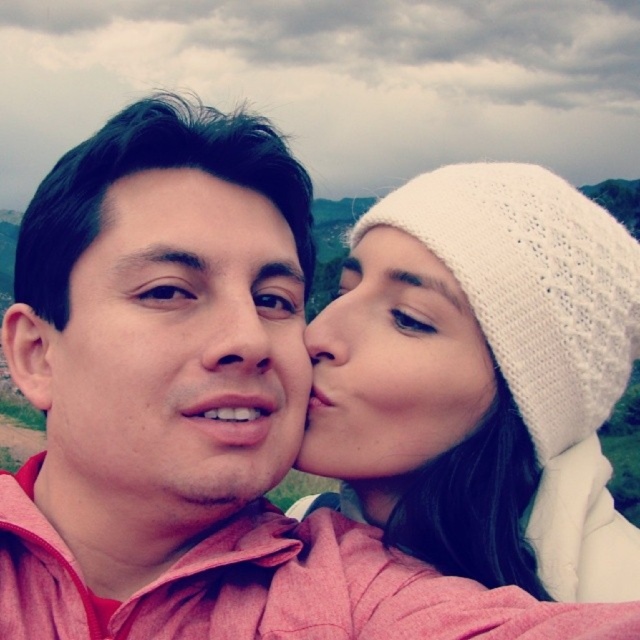
Between white knitted hat at upper right and matte skin nose at center, which one appears on the right side from the viewer's perspective?

From the viewer's perspective, white knitted hat at upper right appears more on the right side.

Can you confirm if white knitted hat at upper right is taller than matte skin nose at center?

Correct, white knitted hat at upper right is much taller as matte skin nose at center.

Is point (452, 349) closer to camera compared to point (218, 356)?

No, it is behind (218, 356).

Where is `white knitted hat at upper right`? The height and width of the screenshot is (640, 640). white knitted hat at upper right is located at coordinates (392, 364).

Can you confirm if matte skin nose at center is positioned to the left of smooth skin nose at center?

Indeed, matte skin nose at center is positioned on the left side of smooth skin nose at center.

Based on the photo, does matte skin nose at center appear over smooth skin nose at center?

No, matte skin nose at center is not above smooth skin nose at center.

Who is more distant from viewer, (x=230, y=346) or (x=349, y=330)?

Positioned behind is point (x=349, y=330).

Identify the location of matte skin nose at center. (243, 333).

Between point (332, 440) and point (420, 436), which one is positioned behind?

The point (332, 440) is behind.

You are a GUI agent. You are given a task and a screenshot of the screen. Output one action in this format:
    pyautogui.click(x=<x>, y=<y>)
    Task: Click on the white knitted beanie at upper right
    This screenshot has width=640, height=640.
    Given the screenshot: What is the action you would take?
    pyautogui.click(x=484, y=380)